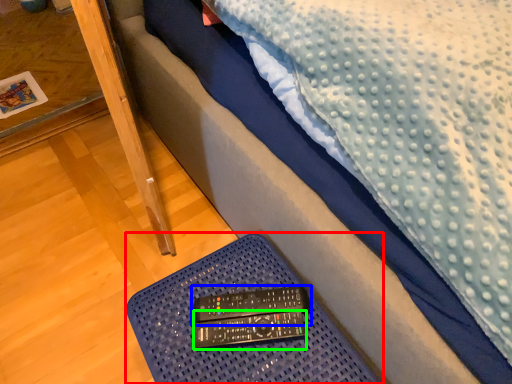
Question: Based on their relative distances, which object is nearer to furniture (highlighted by a red box)? Choose from control (highlighted by a blue box) and control (highlighted by a green box).

Choices:
 (A) control
 (B) control

Answer: (A)